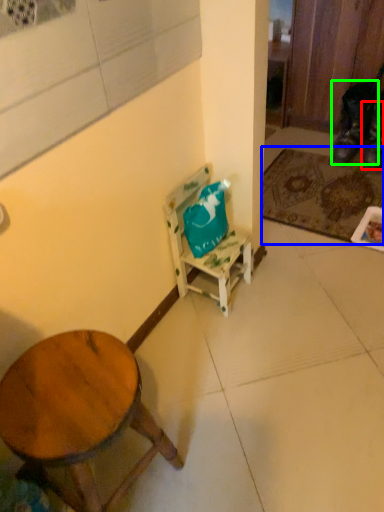
Question: Which object is positioned closest to shoe (highlighted by a red box)? Select from mat (highlighted by a blue box) and shoe (highlighted by a green box).

Choices:
 (A) mat
 (B) shoe

Answer: (B)